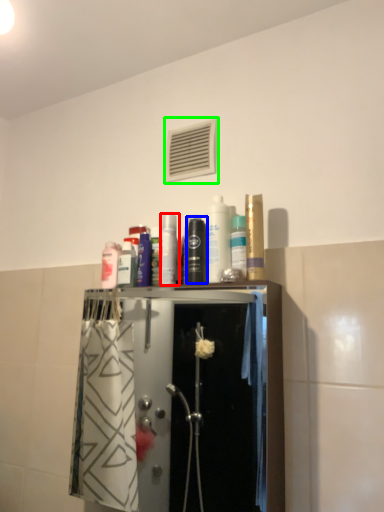
Question: Based on their relative distances, which object is farther from toiletry (highlighted by a red box)? Choose from mouthwash (highlighted by a blue box) and air conditioning (highlighted by a green box).

Choices:
 (A) mouthwash
 (B) air conditioning

Answer: (B)